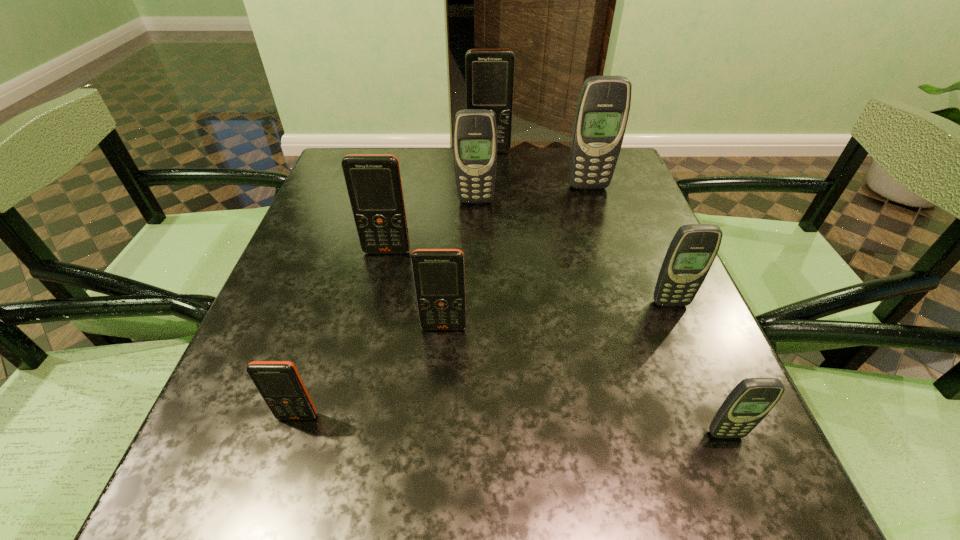
Locate an element on the screen. The width and height of the screenshot is (960, 540). vacant space located on the screen of the fourth nearest cellular telephone is located at coordinates (747, 485).

Where is `free space located on the screen of the sixth farthest object`? This screenshot has height=540, width=960. free space located on the screen of the sixth farthest object is located at coordinates (440, 387).

The image size is (960, 540). In order to click on vacant space located 0.100m on the screen of the second nearest object in this screenshot , I will do `click(274, 492)`.

I want to click on free spot located 0.080m on the screen of the smallest gray cellular telephone, so click(752, 497).

Locate an element on the screen. This screenshot has height=540, width=960. object that is at the far right corner is located at coordinates tap(602, 112).

At what (x,y) coordinates should I click in order to perform the action: click on vacant region at the far edge of the desktop. Please return your answer as a coordinate pair (x, y). The height and width of the screenshot is (540, 960). Looking at the image, I should click on (450, 153).

At what (x,y) coordinates should I click in order to perform the action: click on free space at the near edge of the desktop. Please return your answer as a coordinate pair (x, y). Image resolution: width=960 pixels, height=540 pixels. Looking at the image, I should click on (355, 481).

Image resolution: width=960 pixels, height=540 pixels. Identify the location of vacant space at the left edge of the desktop. (220, 432).

What are the coordinates of `blank space at the right edge` in the screenshot? It's located at (x=708, y=393).

In the image, there is a desktop. Where is `vacant space at the far left corner`? The width and height of the screenshot is (960, 540). vacant space at the far left corner is located at coordinates (354, 147).